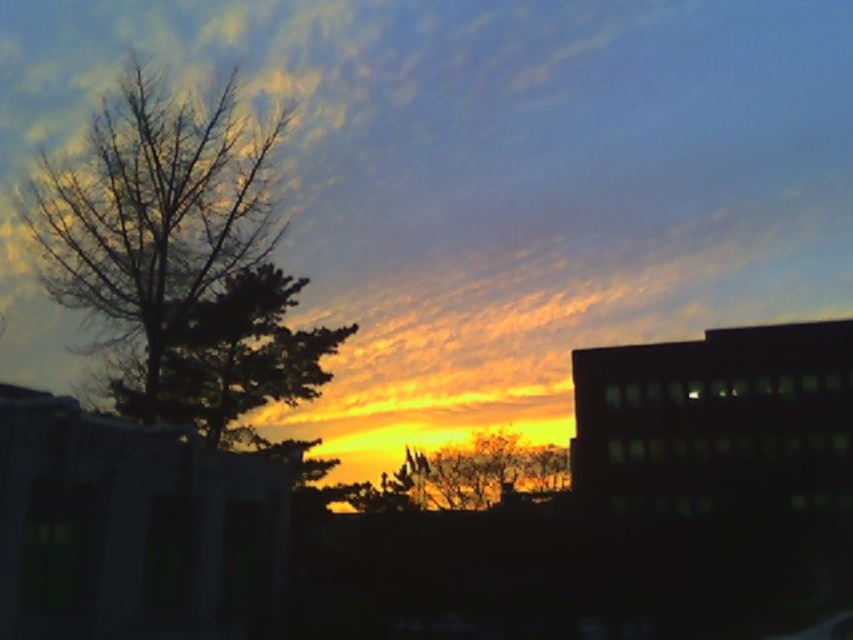
Can you confirm if cloudy sky at center is taller than green leafy tree at upper left?

Yes.

From the picture: Between cloudy sky at center and green leafy tree at upper left, which one appears on the left side from the viewer's perspective?

From the viewer's perspective, green leafy tree at upper left appears more on the left side.

The width and height of the screenshot is (853, 640). I want to click on cloudy sky at center, so click(482, 184).

Can you confirm if bare branches at left is positioned to the right of green leafy tree at upper left?

No, bare branches at left is not to the right of green leafy tree at upper left.

Is point (291, 387) in front of point (268, 301)?

No, (291, 387) is further to viewer.

The width and height of the screenshot is (853, 640). I want to click on bare branches at left, so click(x=175, y=256).

Is cloudy sky at center further to the viewer compared to bare branches at left?

That is True.

Which is more to the left, cloudy sky at center or bare branches at left?

bare branches at left is more to the left.

Between point (621, 58) and point (62, 298), which one is positioned behind?

Positioned behind is point (621, 58).

Locate an element on the screen. This screenshot has width=853, height=640. cloudy sky at center is located at coordinates (482, 184).